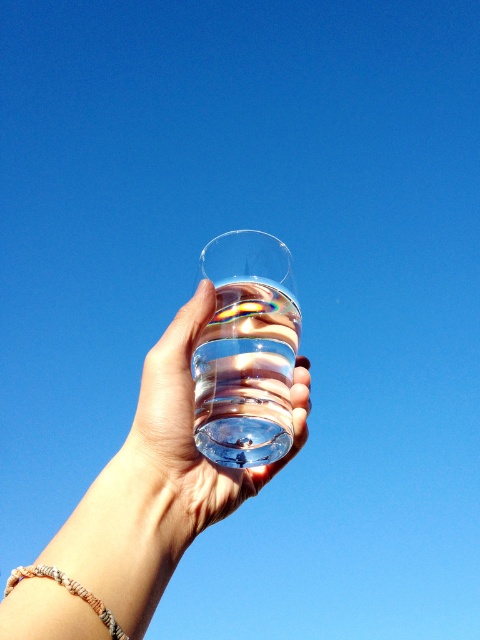
Question: Among these objects, which one is nearest to the camera?

Choices:
 (A) transparent glass water at center
 (B) clear glass water at center
 (C) transparent glass at center
 (D) beige woven bracelet at lower left

Answer: (C)

Question: Which object appears closest to the camera in this image?

Choices:
 (A) transparent glass water at center
 (B) transparent glass at center

Answer: (B)

Question: Can you confirm if clear glass water at center is positioned above transparent glass water at center?

Choices:
 (A) no
 (B) yes

Answer: (A)

Question: Can you confirm if transparent glass at center is positioned above clear glass water at center?

Choices:
 (A) yes
 (B) no

Answer: (B)

Question: Considering the relative positions of transparent glass water at center and beige woven bracelet at lower left in the image provided, where is transparent glass water at center located with respect to beige woven bracelet at lower left?

Choices:
 (A) right
 (B) left

Answer: (A)

Question: Which point is farther to the camera?

Choices:
 (A) (195, 307)
 (B) (84, 541)

Answer: (A)